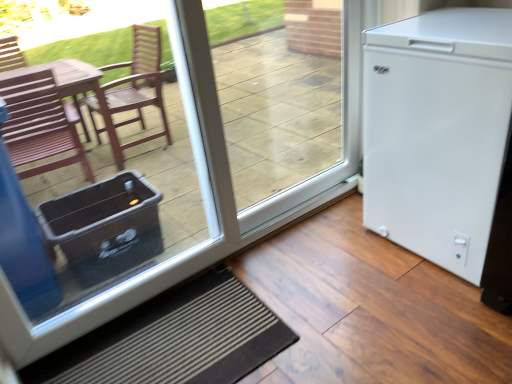
Question: Should I look upward or downward to see white matte refrigerator at right?

Choices:
 (A) up
 (B) down

Answer: (A)

Question: Is transparent glass door at center touching white matte refrigerator at right?

Choices:
 (A) no
 (B) yes

Answer: (A)

Question: Is transparent glass door at center facing away from white matte refrigerator at right?

Choices:
 (A) no
 (B) yes

Answer: (A)

Question: Does transparent glass door at center have a larger size compared to white matte refrigerator at right?

Choices:
 (A) no
 (B) yes

Answer: (A)

Question: Does transparent glass door at center come in front of white matte refrigerator at right?

Choices:
 (A) yes
 (B) no

Answer: (B)

Question: Is transparent glass door at center located outside white matte refrigerator at right?

Choices:
 (A) yes
 (B) no

Answer: (A)

Question: Is the position of transparent glass door at center more distant than that of white matte refrigerator at right?

Choices:
 (A) yes
 (B) no

Answer: (A)

Question: Is transparent glass door at center with white matte refrigerator at right?

Choices:
 (A) yes
 (B) no

Answer: (B)

Question: Is transparent glass door at center positioned behind white matte refrigerator at right?

Choices:
 (A) no
 (B) yes

Answer: (B)

Question: Is transparent glass door at center positioned with its back to white matte refrigerator at right?

Choices:
 (A) yes
 (B) no

Answer: (A)

Question: Can you confirm if transparent glass door at center is taller than white matte refrigerator at right?

Choices:
 (A) no
 (B) yes

Answer: (A)

Question: Is transparent glass door at center closer to the viewer compared to white matte refrigerator at right?

Choices:
 (A) no
 (B) yes

Answer: (A)

Question: From the image's perspective, is transparent glass door at center above white matte refrigerator at right?

Choices:
 (A) no
 (B) yes

Answer: (B)

Question: Can you confirm if white matte refrigerator at right is positioned to the left of black textured mat at lower center?

Choices:
 (A) no
 (B) yes

Answer: (A)